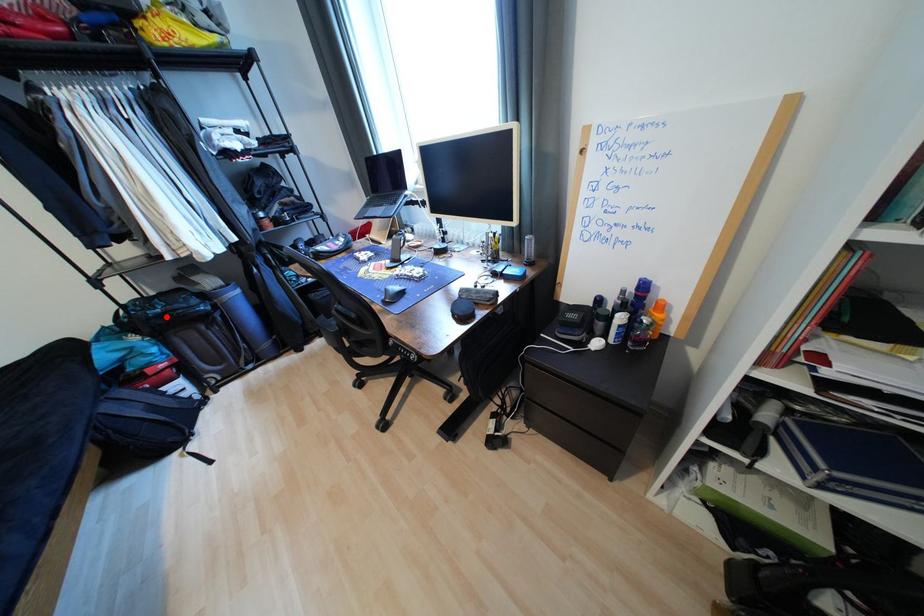
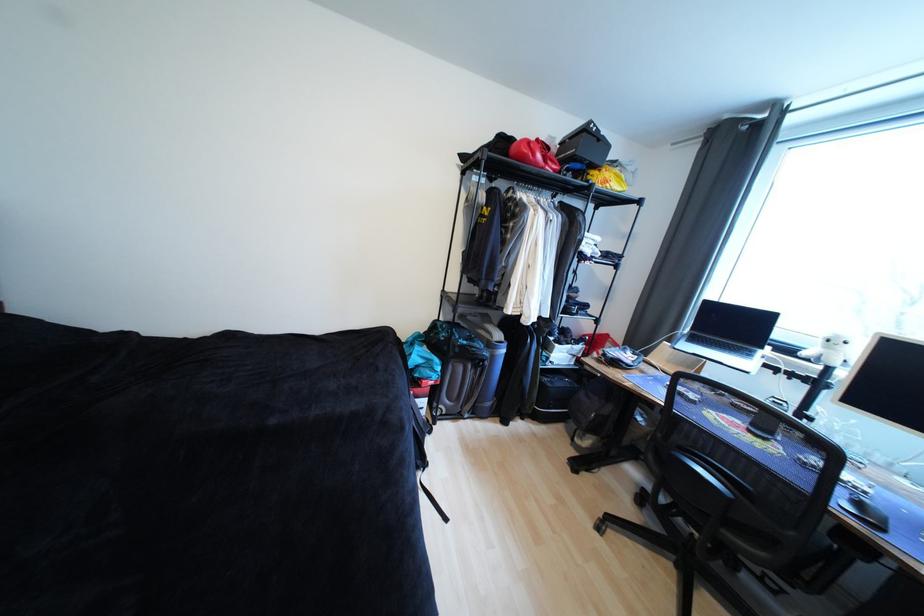
In the second image, find the point that corresponds to the highlighted location in the first image.

(469, 347)